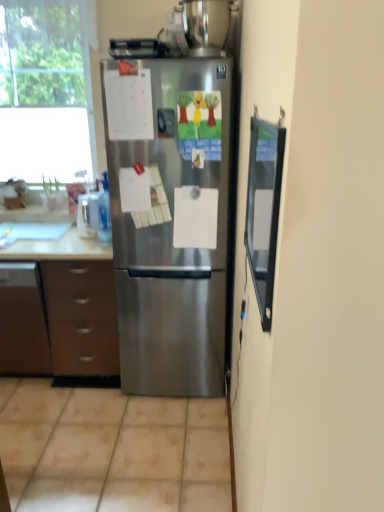
This screenshot has height=512, width=384. Describe the element at coordinates (169, 220) in the screenshot. I see `stainless steel refrigerator at center` at that location.

At what (x,y) coordinates should I click in order to perform the action: click on transparent glass window at upper left. Please return your answer as a coordinate pair (x, y). Image resolution: width=384 pixels, height=512 pixels. Looking at the image, I should click on (45, 92).

You are a GUI agent. You are given a task and a screenshot of the screen. Output one action in this format:
    pyautogui.click(x=<x>, y=<y>)
    Task: Click on the white glossy sink at left
    
    Given the screenshot: What is the action you would take?
    pyautogui.click(x=34, y=230)

Describe the element at coordinates (264, 210) in the screenshot. I see `transparent glass screen door at right` at that location.

What do you see at coordinates (138, 48) in the screenshot? The height and width of the screenshot is (512, 384). I see `satin silver refrigerator at upper center, marked as the first appliance in a left-to-right arrangement` at bounding box center [138, 48].

This screenshot has height=512, width=384. In order to click on stainless steel refrigerator at center in this screenshot , I will do `click(169, 220)`.

Between transparent glass window at upper left and satin silver refrigerator at upper center, marked as the first appliance in a left-to-right arrangement, which one has less height?

satin silver refrigerator at upper center, marked as the first appliance in a left-to-right arrangement, is shorter.

From a real-world perspective, between transparent glass window at upper left and satin silver refrigerator at upper center, placed as the second appliance when sorted from right to left, who is vertically lower?

transparent glass window at upper left, from a real-world perspective.

Is transparent glass window at upper left not near satin silver refrigerator at upper center, marked as the first appliance in a left-to-right arrangement?

They are positioned close to each other.

Is satin silver refrigerator at upper center, marked as the first appliance in a left-to-right arrangement, at the back of transparent glass window at upper left?

No, transparent glass window at upper left's orientation is not away from satin silver refrigerator at upper center, marked as the first appliance in a left-to-right arrangement.

Considering the points (188, 44) and (137, 42), which point is behind, point (188, 44) or point (137, 42)?

The point (188, 44) is more distant.

Does stainless steel pot at upper center, which is the 1th appliance in right-to-left order, touch satin silver refrigerator at upper center, marked as the first appliance in a left-to-right arrangement?

stainless steel pot at upper center, which is the 1th appliance in right-to-left order, and satin silver refrigerator at upper center, marked as the first appliance in a left-to-right arrangement, are clearly separated.

Which of these two, stainless steel pot at upper center, marked as the second appliance in a left-to-right arrangement, or satin silver refrigerator at upper center, placed as the second appliance when sorted from right to left, is thinner?

Thinner between the two is satin silver refrigerator at upper center, placed as the second appliance when sorted from right to left.

Measure the distance between beige tile at lower center and transparent glass window at upper left.

The distance of beige tile at lower center from transparent glass window at upper left is 1.79 meters.

From the picture: Is beige tile at lower center bigger than transparent glass window at upper left?

Yes, beige tile at lower center is bigger than transparent glass window at upper left.

Are beige tile at lower center and transparent glass window at upper left located far from each other?

Indeed, beige tile at lower center is not near transparent glass window at upper left.

Between point (119, 485) and point (44, 27), which one is positioned in front?

The point (119, 485) is in front.

Which object is closer to the camera, beige tile at lower center or brown matte cabinet at lower left?

beige tile at lower center is in front.

Would you say beige tile at lower center is a long distance from brown matte cabinet at lower left?

No, there isn't a large distance between beige tile at lower center and brown matte cabinet at lower left.

Who is smaller, beige tile at lower center or brown matte cabinet at lower left?

beige tile at lower center.

Would you say brown matte cabinet at lower left is part of beige tile at lower center's contents?

That's incorrect, brown matte cabinet at lower left is not inside beige tile at lower center.

Considering the sizes of objects stainless steel pot at upper center, which is the 1th appliance in right-to-left order, and beige tile at lower center in the image provided, who is smaller, stainless steel pot at upper center, which is the 1th appliance in right-to-left order, or beige tile at lower center?

stainless steel pot at upper center, which is the 1th appliance in right-to-left order, is smaller.

Is stainless steel pot at upper center, marked as the second appliance in a left-to-right arrangement, facing towards beige tile at lower center?

No, stainless steel pot at upper center, marked as the second appliance in a left-to-right arrangement, is not turned towards beige tile at lower center.

From a real-world perspective, is stainless steel pot at upper center, marked as the second appliance in a left-to-right arrangement, on beige tile at lower center?

Yes, from a real-world perspective, stainless steel pot at upper center, marked as the second appliance in a left-to-right arrangement, is on top of beige tile at lower center.

In the scene shown: Which of these two, beige tile at lower center or stainless steel pot at upper center, which is the 1th appliance in right-to-left order, is smaller?

Smaller between the two is stainless steel pot at upper center, which is the 1th appliance in right-to-left order.

Find the location of a particular element. This screenshot has height=512, width=384. tile in front of the stainless steel pot at upper center, which is the 1th appliance in right-to-left order is located at coordinates (111, 450).

Does point (161, 415) appear closer or farther from the camera than point (203, 1)?

Point (161, 415) is positioned farther from the camera compared to point (203, 1).

Would you say stainless steel pot at upper center, marked as the second appliance in a left-to-right arrangement, contains transparent glass screen door at right?

No, transparent glass screen door at right is not inside stainless steel pot at upper center, marked as the second appliance in a left-to-right arrangement.

From a real-world perspective, who is located higher, stainless steel pot at upper center, which is the 1th appliance in right-to-left order, or transparent glass screen door at right?

From a 3D spatial view, stainless steel pot at upper center, which is the 1th appliance in right-to-left order, is above.

From their relative heights in the image, would you say stainless steel pot at upper center, marked as the second appliance in a left-to-right arrangement, is taller or shorter than transparent glass screen door at right?

Considering their sizes, stainless steel pot at upper center, marked as the second appliance in a left-to-right arrangement, has less height than transparent glass screen door at right.

This screenshot has height=512, width=384. Identify the location of screen door that is below the stainless steel pot at upper center, which is the 1th appliance in right-to-left order (from the image's perspective). (264, 210).

Locate an element on the screen. The height and width of the screenshot is (512, 384). window behind the satin silver refrigerator at upper center, placed as the second appliance when sorted from right to left is located at coordinates (45, 92).

This screenshot has width=384, height=512. What are the coordinates of `appliance that is above the satin silver refrigerator at upper center, marked as the first appliance in a left-to-right arrangement (from the image's perspective)` in the screenshot? It's located at (200, 27).

Which object lies further to the anchor point transparent glass screen door at right, beige tile at lower center or stainless steel pot at upper center, which is the 1th appliance in right-to-left order?

beige tile at lower center.

Estimate the real-world distances between objects in this image. Which object is closer to transparent glass window at upper left, brown matte cabinet at lower left or stainless steel refrigerator at center?

stainless steel refrigerator at center is closer to transparent glass window at upper left.

Based on their spatial positions, is brown matte cabinet at lower left or white glossy sink at left further from transparent glass window at upper left?

brown matte cabinet at lower left is further to transparent glass window at upper left.

When comparing their distances from transparent glass window at upper left, does white glossy sink at left or stainless steel refrigerator at center seem closer?

white glossy sink at left lies closer to transparent glass window at upper left than the other object.

Looking at the image, which one is located closer to transparent glass window at upper left, brown matte cabinet at lower left or satin silver refrigerator at upper center, placed as the second appliance when sorted from right to left?

satin silver refrigerator at upper center, placed as the second appliance when sorted from right to left.

Based on their spatial positions, is satin silver refrigerator at upper center, marked as the first appliance in a left-to-right arrangement, or brown matte cabinet at lower left further from stainless steel refrigerator at center?

satin silver refrigerator at upper center, marked as the first appliance in a left-to-right arrangement, is positioned further to the anchor stainless steel refrigerator at center.

Based on their spatial positions, is white glossy sink at left or beige tile at lower center further from transparent glass window at upper left?

Based on the image, beige tile at lower center appears to be further to transparent glass window at upper left.

Looking at the image, which one is located closer to transparent glass screen door at right, transparent glass window at upper left or stainless steel refrigerator at center?

stainless steel refrigerator at center lies closer to transparent glass screen door at right than the other object.

Image resolution: width=384 pixels, height=512 pixels. What are the coordinates of `refrigerator located between transparent glass screen door at right and brown matte cabinet at lower left in the depth direction` in the screenshot? It's located at (169, 220).

Identify the location of sink between transparent glass window at upper left and stainless steel pot at upper center, marked as the second appliance in a left-to-right arrangement. The width and height of the screenshot is (384, 512). (34, 230).

Locate an element on the screen. This screenshot has width=384, height=512. sink situated between transparent glass window at upper left and stainless steel refrigerator at center from left to right is located at coordinates (34, 230).

Locate an element on the screen. This screenshot has width=384, height=512. cabinetry that lies between white glossy sink at left and beige tile at lower center from top to bottom is located at coordinates (79, 319).